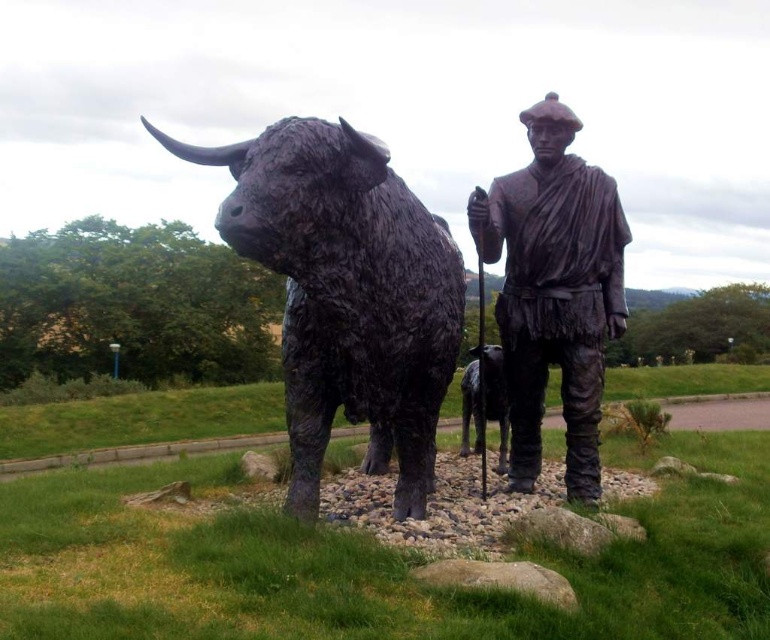
Is black textured bull at center smaller than shiny black dog at center?

Actually, black textured bull at center might be larger than shiny black dog at center.

Is point (444, 237) farther from viewer compared to point (497, 413)?

No.

Which is in front, point (313, 134) or point (500, 394)?

Point (313, 134) is in front.

I want to click on black textured bull at center, so click(346, 294).

Is black textured bull at center above bronze statue at center?

Actually, black textured bull at center is below bronze statue at center.

Which of these two, black textured bull at center or bronze statue at center, stands taller?

bronze statue at center is taller.

What are the coordinates of `black textured bull at center` in the screenshot? It's located at (346, 294).

Which is more to the right, bronze statue at center or shiny black dog at center?

bronze statue at center

Between point (548, 280) and point (500, 456), which one is positioned in front?

Point (548, 280)

Is point (553, 289) behind point (477, 385)?

No, (553, 289) is in front of (477, 385).

You are a GUI agent. You are given a task and a screenshot of the screen. Output one action in this format:
    pyautogui.click(x=<x>, y=<y>)
    Task: Click on the bronze statue at center
    This screenshot has height=640, width=770.
    Given the screenshot: What is the action you would take?
    pyautogui.click(x=554, y=291)